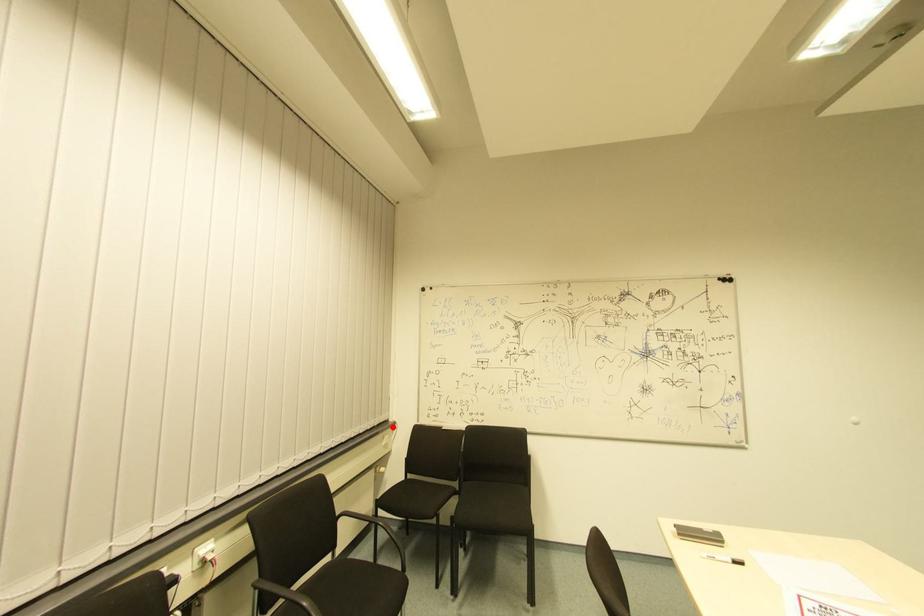
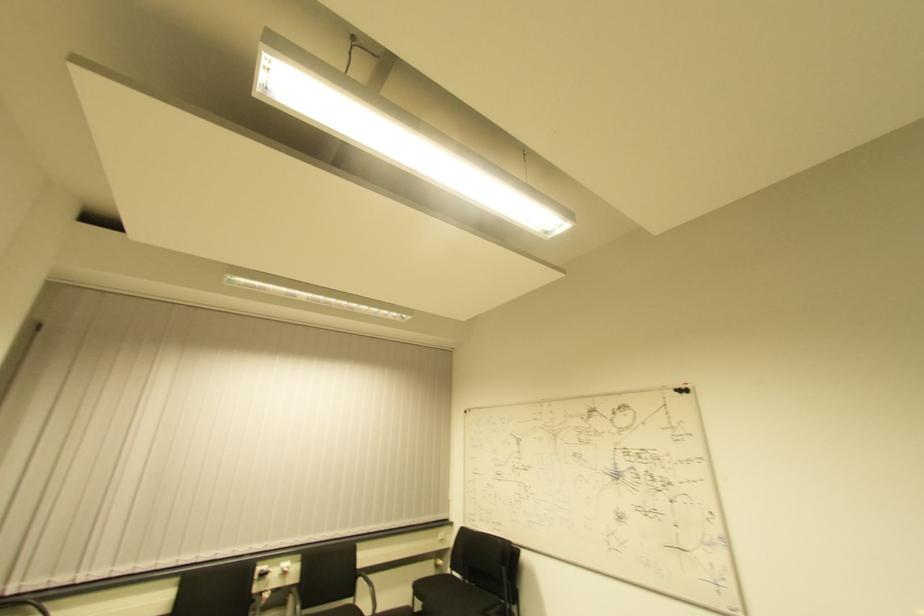
Question: I am providing you with two images of the same scene from different viewpoints. A red point is marked on the first image. At the location where the point appears in image 1, is it still visible in image 2?

Choices:
 (A) Yes
 (B) No

Answer: (A)